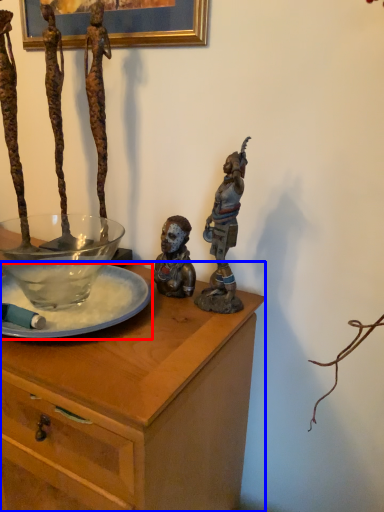
Question: Which of the following is the farthest to the observer, glass plate (highlighted by a red box) or desk (highlighted by a blue box)?

Choices:
 (A) glass plate
 (B) desk

Answer: (A)